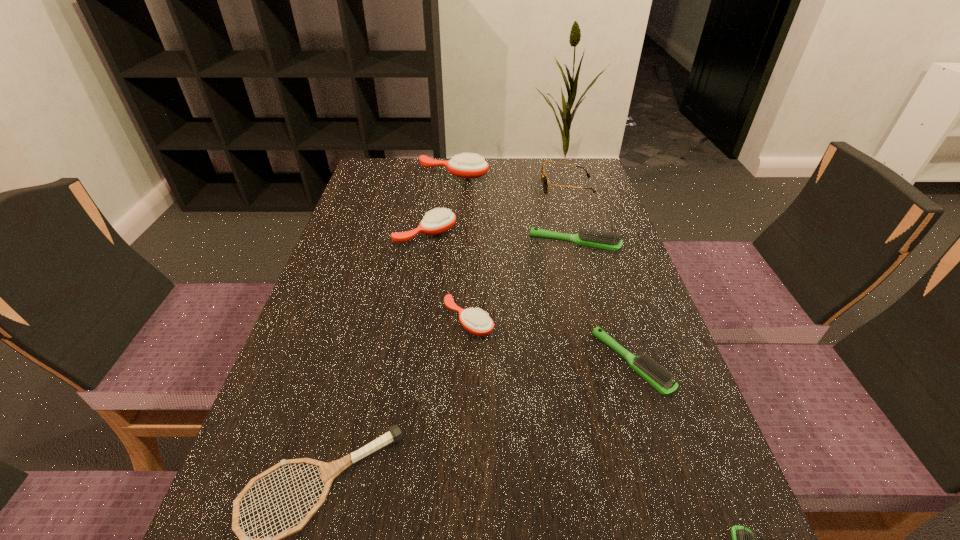
I want to click on free space between the second biggest light hairbrush and the farthest light hairbrush, so click(x=603, y=303).

The width and height of the screenshot is (960, 540). What are the coordinates of `free space between the nearest orange hairbrush and the black sunglasses` in the screenshot? It's located at (517, 253).

This screenshot has width=960, height=540. Find the location of `vacant area that lies between the black sunglasses and the biggest light hairbrush`. vacant area that lies between the black sunglasses and the biggest light hairbrush is located at coordinates (571, 215).

I want to click on vacant point located between the nearest orange hairbrush and the farthest orange hairbrush, so click(461, 247).

I want to click on the second closest object to the smallest orange hairbrush, so click(x=599, y=240).

Select which object appears as the seventh closest to the farthest light hairbrush. Please provide its 2D coordinates. Your answer should be formatted as a tuple, i.e. [(x, y)], where the tuple contains the x and y coordinates of a point satisfying the conditions above.

[(742, 538)]

Locate which hairbrush ranks in proximity to the nearest light hairbrush. Please provide its 2D coordinates. Your answer should be formatted as a tuple, i.e. [(x, y)], where the tuple contains the x and y coordinates of a point satisfying the conditions above.

[(652, 372)]

Find the location of a particular element. hairbrush that is the fifth closest to the second biggest light hairbrush is located at coordinates (469, 165).

Select which orange hairbrush is the closest to the tallest hairbrush. Please provide its 2D coordinates. Your answer should be formatted as a tuple, i.e. [(x, y)], where the tuple contains the x and y coordinates of a point satisfying the conditions above.

[(440, 220)]

Point out which orange hairbrush is positioned as the nearest to the nearest orange hairbrush. Please provide its 2D coordinates. Your answer should be formatted as a tuple, i.e. [(x, y)], where the tuple contains the x and y coordinates of a point satisfying the conditions above.

[(440, 220)]